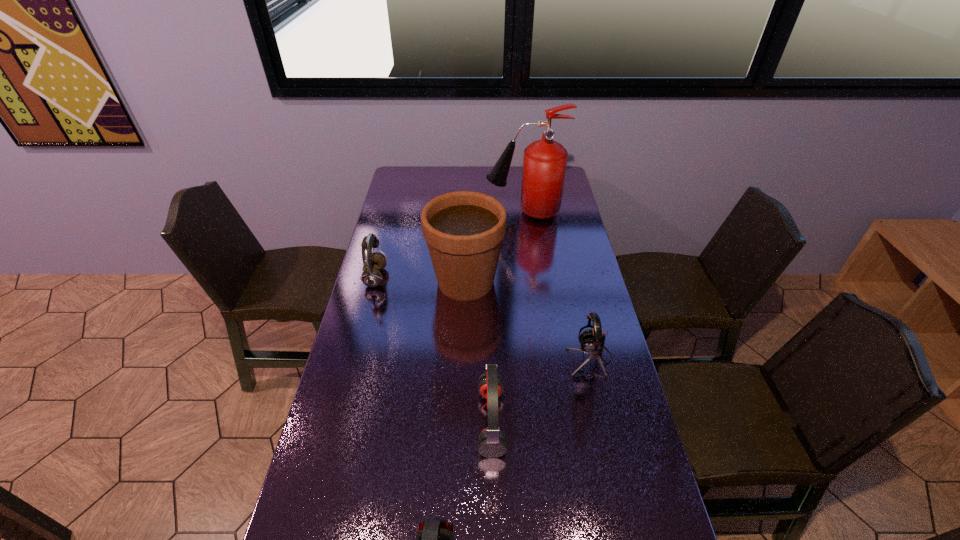
Identify the location of earphone that is the second closest to the second nearest earphone. The height and width of the screenshot is (540, 960). coord(592,342).

Locate which earphone is the closest to the leftmost earphone. Please provide its 2D coordinates. Your answer should be formatted as a tuple, i.e. [(x, y)], where the tuple contains the x and y coordinates of a point satisfying the conditions above.

[(492, 443)]

The image size is (960, 540). I want to click on blank area in the image that satisfies the following two spatial constraints: 1. on the back side of the third nearest earphone; 2. with the nozzle aimed from the farthest object, so click(556, 212).

Find the location of a particular element. Image resolution: width=960 pixels, height=540 pixels. free location that satisfies the following two spatial constraints: 1. on the ear pads of the leftmost earphone; 2. on the back side of the third nearest earphone is located at coordinates (354, 358).

You are a GUI agent. You are given a task and a screenshot of the screen. Output one action in this format:
    pyautogui.click(x=<x>, y=<y>)
    Task: Click on the free spot that satisfies the following two spatial constraints: 1. on the ear pads of the farthest earphone; 2. on the back side of the flowerpot
    The image size is (960, 540).
    Given the screenshot: What is the action you would take?
    click(x=374, y=281)

At what (x,y) coordinates should I click in order to perform the action: click on free spot that satisfies the following two spatial constraints: 1. on the back side of the rightmost earphone; 2. on the ear pads of the leftmost earphone. Please return your answer as a coordinate pair (x, y). Looking at the image, I should click on (571, 278).

Locate an element on the screen. vacant region that satisfies the following two spatial constraints: 1. on the ear pads of the third nearest object; 2. on the right side of the farthest earphone is located at coordinates (354, 358).

At what (x,y) coordinates should I click in order to perform the action: click on vacant region that satisfies the following two spatial constraints: 1. on the back side of the rightmost earphone; 2. with the nozzle aimed from the farthest object. Please return your answer as a coordinate pair (x, y). Looking at the image, I should click on (556, 212).